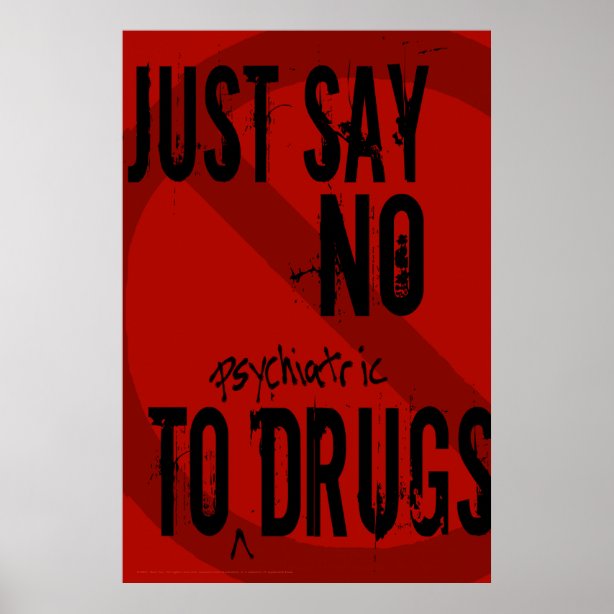
Where is `poster`? poster is located at coordinates (487, 252).